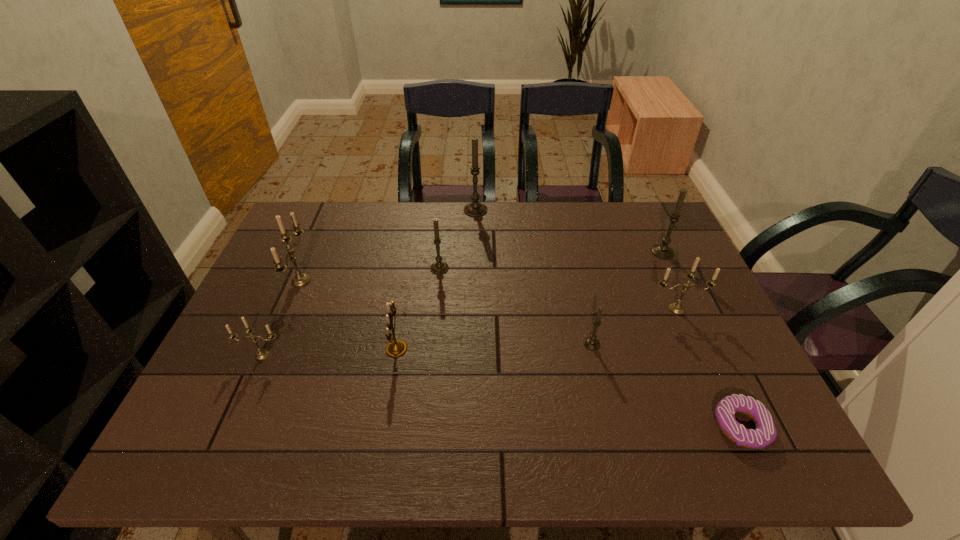
This screenshot has width=960, height=540. I want to click on the farthest object, so click(475, 209).

In order to click on the biggest gray candle in this screenshot , I will do `click(475, 209)`.

Where is `the biggest metallic candle`? The height and width of the screenshot is (540, 960). the biggest metallic candle is located at coordinates (300, 279).

I want to click on the second farthest candle, so click(x=663, y=251).

Identify the location of the second farthest object. The width and height of the screenshot is (960, 540). (663, 251).

The image size is (960, 540). Identify the location of the second smallest gray candle. (439, 267).

Locate an element on the screen. Image resolution: width=960 pixels, height=540 pixels. the fifth candle from right to left is located at coordinates (439, 267).

You are a GUI agent. You are given a task and a screenshot of the screen. Output one action in this format:
    pyautogui.click(x=<x>, y=<y>)
    Task: Click on the rightmost metallic candle
    
    Given the screenshot: What is the action you would take?
    point(677,308)

Locate an element on the screen. This screenshot has height=540, width=960. candelabrum is located at coordinates (395, 348).

In order to click on gold candelabrum in this screenshot , I will do `click(395, 348)`.